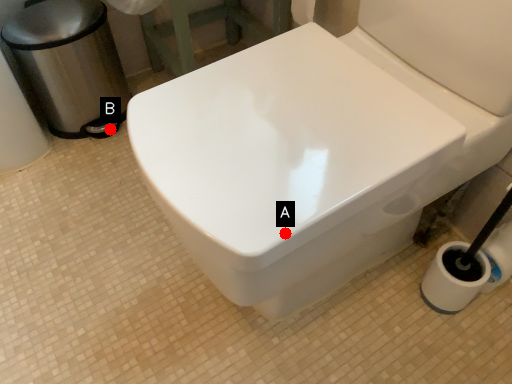
Question: Two points are circled on the image, labeled by A and B beside each circle. Which point is closer to the camera taking this photo?

Choices:
 (A) A is closer
 (B) B is closer

Answer: (A)